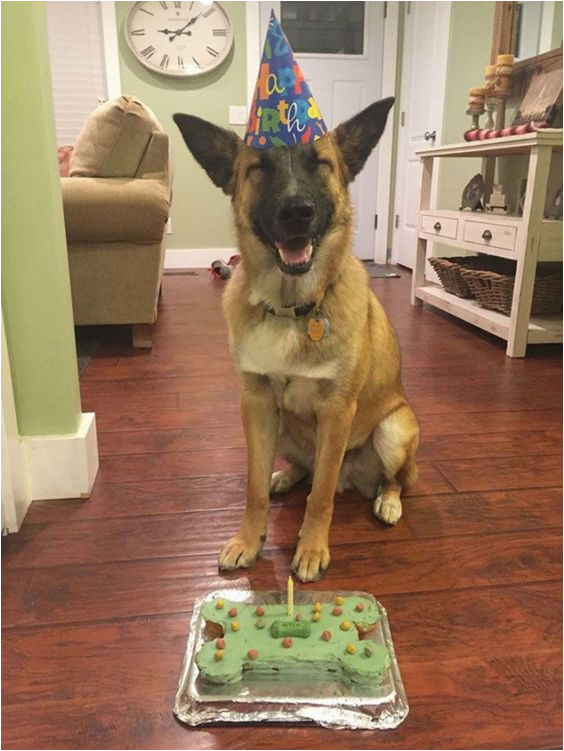
The image size is (564, 751). I want to click on candle, so (295, 583).